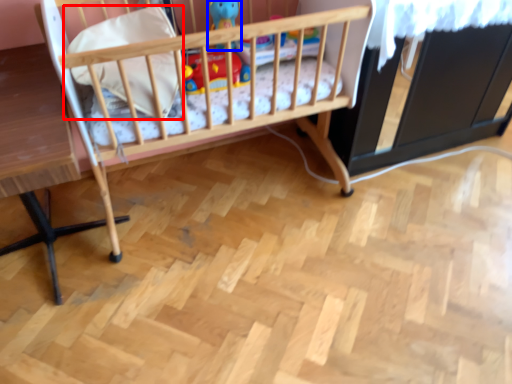
Question: Which point is closer to the camera, pillow (highlighted by a red box) or toy (highlighted by a blue box)?

Choices:
 (A) pillow
 (B) toy

Answer: (A)